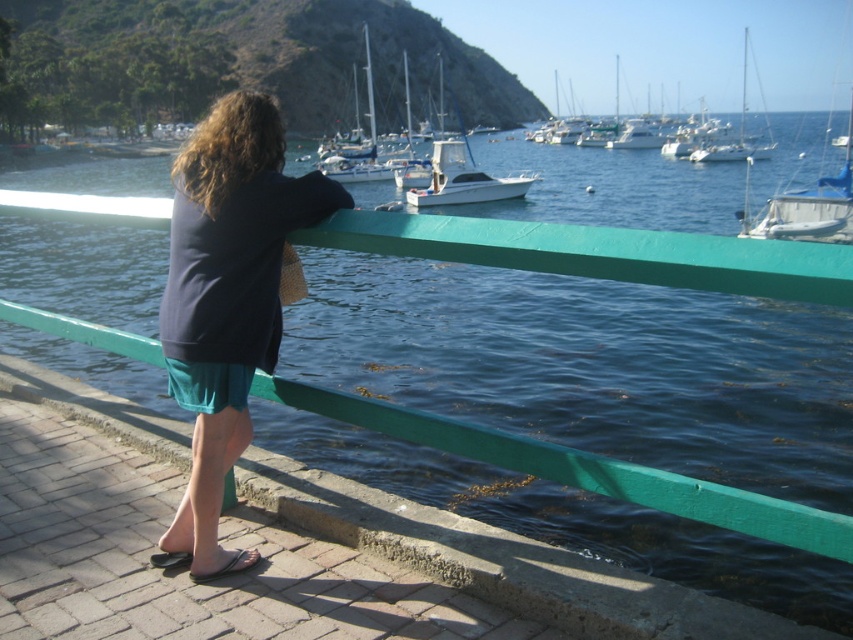
Question: Which of the following is the closest to the observer?

Choices:
 (A) (744, 67)
 (B) (235, 572)
 (C) (213, 349)

Answer: (C)

Question: Is dark blue sweater at center above white glossy sailboat at center?

Choices:
 (A) no
 (B) yes

Answer: (A)

Question: Estimate the real-world distances between objects in this image. Which object is closer to the white glossy sailboat at center?

Choices:
 (A) brown leather sandal at lower left
 (B) white glossy sailboat at upper right

Answer: (B)

Question: Can you confirm if white glossy boat at center is wider than white glossy sailboat at upper right?

Choices:
 (A) no
 (B) yes

Answer: (A)

Question: Does white glossy boat at center come in front of white glossy sailboat at upper right?

Choices:
 (A) yes
 (B) no

Answer: (A)

Question: Which point is farther to the camera?

Choices:
 (A) white glossy boat at center
 (B) white glossy sailboat at upper right

Answer: (B)